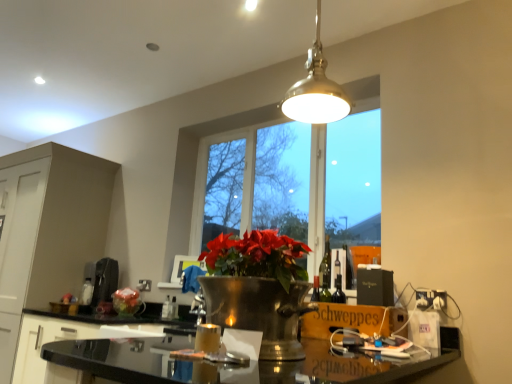
What do you see at coordinates (47, 231) in the screenshot? The image size is (512, 384). I see `matte white cabinet at left, positioned as the 2th cabinetry in right-to-left order` at bounding box center [47, 231].

What is the approximate width of wooden schweppes box at lower right?

It is 11.46 inches.

At what (x,y) coordinates should I click in order to perform the action: click on translucent glass bottle at center, positioned as the 2th bottle in right-to-left order. Please return your answer as a coordinate pair (x, y). The height and width of the screenshot is (384, 512). Looking at the image, I should click on 166,309.

This screenshot has height=384, width=512. Identify the location of matte white cabinet at left, marked as the first cabinetry in a left-to-right arrangement. (47, 231).

Does clear glass window at center have a greater width compared to matte white cabinet at left, positioned as the 2th cabinetry in right-to-left order?

No, clear glass window at center is not wider than matte white cabinet at left, positioned as the 2th cabinetry in right-to-left order.

There is a clear glass window at center. Where is `the 1st cabinetry below it (from a real-world perspective)`? the 1st cabinetry below it (from a real-world perspective) is located at coordinates (47, 231).

Is clear glass window at center looking in the opposite direction of matte white cabinet at left, marked as the first cabinetry in a left-to-right arrangement?

clear glass window at center does not have its back to matte white cabinet at left, marked as the first cabinetry in a left-to-right arrangement.

Is clear glass window at center situated inside matte white cabinet at left, positioned as the 2th cabinetry in right-to-left order, or outside?

A: clear glass window at center is not enclosed by matte white cabinet at left, positioned as the 2th cabinetry in right-to-left order.

What's the angular difference between white plastic electric outlet at lower right and metallic silver flower at center's facing directions?

The angle between the facing direction of white plastic electric outlet at lower right and the facing direction of metallic silver flower at center is 2.73 degrees.

Does point (433, 291) come farther from viewer compared to point (127, 287)?

No.

Does white plastic electric outlet at lower right have a larger size compared to metallic silver flower at center?

No, white plastic electric outlet at lower right is not bigger than metallic silver flower at center.

From a real-world perspective, is white plastic electric outlet at lower right on top of metallic silver flower at center?

Yes.

Does point (63, 214) come in front of point (172, 308)?

No.

Is matte white cabinet at left, positioned as the 2th cabinetry in right-to-left order, situated inside translucent glass bottle at center, which is counted as the first bottle, starting from the right, or outside?

matte white cabinet at left, positioned as the 2th cabinetry in right-to-left order, is located beyond the bounds of translucent glass bottle at center, which is counted as the first bottle, starting from the right.

Considering the positions of objects matte white cabinet at left, marked as the first cabinetry in a left-to-right arrangement, and translucent glass bottle at center, the second bottle in the left-to-right sequence, in the image provided, who is more to the left, matte white cabinet at left, marked as the first cabinetry in a left-to-right arrangement, or translucent glass bottle at center, the second bottle in the left-to-right sequence,?

From the viewer's perspective, matte white cabinet at left, marked as the first cabinetry in a left-to-right arrangement, appears more on the left side.

From the image's perspective, is matte white cabinet at left, positioned as the 2th cabinetry in right-to-left order, located above translucent glass bottle at center, the second bottle in the left-to-right sequence?

Yes, from the image's perspective, matte white cabinet at left, positioned as the 2th cabinetry in right-to-left order, is above translucent glass bottle at center, the second bottle in the left-to-right sequence.

Which object is closer to the camera, metallic silver flower at center or translucent glass bottle at center, the second bottle in the left-to-right sequence?

Positioned in front is translucent glass bottle at center, the second bottle in the left-to-right sequence.

From a real-world perspective, between metallic silver flower at center and translucent glass bottle at center, the second bottle in the left-to-right sequence, who is vertically lower?

translucent glass bottle at center, the second bottle in the left-to-right sequence.

Is metallic silver flower at center taller than translucent glass bottle at center, the second bottle in the left-to-right sequence?

Yes.

What's the angular difference between metallic silver flower at center and translucent glass bottle at center, which is counted as the first bottle, starting from the right,'s facing directions?

metallic silver flower at center and translucent glass bottle at center, which is counted as the first bottle, starting from the right, are facing 1.32 degrees away from each other.

Could you tell me if clear glass window at center is facing white plastic electric outlet at lower right?

No, clear glass window at center is not oriented towards white plastic electric outlet at lower right.

Is point (237, 179) farther from camera compared to point (423, 308)?

Yes, it is behind point (423, 308).

Based on the photo, from the image's perspective, which one is positioned higher, clear glass window at center or white plastic electric outlet at lower right?

clear glass window at center appears higher in the image.

Is clear glass window at center behind metallic silver flower at center?

No, it is in front of metallic silver flower at center.

Can you confirm if clear glass window at center is smaller than metallic silver flower at center?

Incorrect, clear glass window at center is not smaller in size than metallic silver flower at center.

Is clear glass window at center outside of metallic silver flower at center?

clear glass window at center is positioned outside metallic silver flower at center.

Measure the distance from wooden schweppes box at lower right to metallic silver flower at center.

A distance of 1.66 meters exists between wooden schweppes box at lower right and metallic silver flower at center.

In the scene shown: Based on their positions, is wooden schweppes box at lower right located to the left or right of metallic silver flower at center?

From the image, it's evident that wooden schweppes box at lower right is to the right of metallic silver flower at center.

In terms of size, does wooden schweppes box at lower right appear bigger or smaller than metallic silver flower at center?

wooden schweppes box at lower right is bigger than metallic silver flower at center.

Is wooden schweppes box at lower right inside or outside of metallic silver flower at center?

wooden schweppes box at lower right is located beyond the bounds of metallic silver flower at center.

You are a GUI agent. You are given a task and a screenshot of the screen. Output one action in this format:
    pyautogui.click(x=<x>, y=<y>)
    Task: Click on the window in front of the matte white cabinet at left, positioned as the 2th cabinetry in right-to-left order
    
    Given the screenshot: What is the action you would take?
    pyautogui.click(x=293, y=180)

At what (x,y) coordinates should I click in order to perform the action: click on electric outlet above the metallic silver flower at center (from the image's perspective). Please return your answer as a coordinate pair (x, y). Image resolution: width=512 pixels, height=384 pixels. Looking at the image, I should click on (431, 299).

Which object lies further to the anchor point white plastic electric outlet at lower right, metallic pendant light at upper center or translucent glass bottle at center, which ranks as the 1th bottle in left-to-right order?

translucent glass bottle at center, which ranks as the 1th bottle in left-to-right order.

Based on their spatial positions, is black matte coffee machine at left or clear glass window at center further from matte white cabinet at left, marked as the first cabinetry in a left-to-right arrangement?

Based on the image, clear glass window at center appears to be further to matte white cabinet at left, marked as the first cabinetry in a left-to-right arrangement.

Looking at the image, which one is located closer to wooden schweppes box at lower right, black glossy countertop at lower center, which ranks as the first cabinetry in right-to-left order, or matte white cabinet at left, marked as the first cabinetry in a left-to-right arrangement?

Based on the image, black glossy countertop at lower center, which ranks as the first cabinetry in right-to-left order, appears to be nearer to wooden schweppes box at lower right.

Which object lies further to the anchor point white plastic electric outlet at lower right, black glossy countertop at center or translucent glass bottle at center, which is counted as the first bottle, starting from the right?

black glossy countertop at center is further to white plastic electric outlet at lower right.

Which object lies further to the anchor point black glossy countertop at center, metallic pendant light at upper center or matte white cabinet at left, marked as the first cabinetry in a left-to-right arrangement?

metallic pendant light at upper center is further to black glossy countertop at center.

When comparing their distances from metallic pendant light at upper center, does black glossy countertop at center or matte white cabinet at left, positioned as the 2th cabinetry in right-to-left order, seem further?

matte white cabinet at left, positioned as the 2th cabinetry in right-to-left order.

Estimate the real-world distances between objects in this image. Which object is closer to black glossy countertop at center, matte white cabinet at left, positioned as the 2th cabinetry in right-to-left order, or metallic pendant light at upper center?

matte white cabinet at left, positioned as the 2th cabinetry in right-to-left order, is positioned closer to the anchor black glossy countertop at center.

When comparing their distances from black matte coffee machine at left, does matte white cabinet at left, marked as the first cabinetry in a left-to-right arrangement, or translucent glass bottle at center, positioned as the 2th bottle in right-to-left order, seem closer?

translucent glass bottle at center, positioned as the 2th bottle in right-to-left order, is positioned closer to the anchor black matte coffee machine at left.

At what (x,y) coordinates should I click in order to perform the action: click on window between translucent glass bottle at center, which ranks as the 1th bottle in left-to-right order, and white plastic electric outlet at lower right. Please return your answer as a coordinate pair (x, y). The image size is (512, 384). Looking at the image, I should click on (293, 180).

The image size is (512, 384). In order to click on cardboard box between black glossy countertop at center and clear glass window at center in the front-back direction in this screenshot , I will do 354,320.

Image resolution: width=512 pixels, height=384 pixels. I want to click on window between black matte coffee machine at left and wooden schweppes box at lower right in the horizontal direction, so click(293, 180).

Where is `electric outlet that lies between metallic pendant light at upper center and translucent glass bottle at center, which is counted as the first bottle, starting from the right, from top to bottom`? electric outlet that lies between metallic pendant light at upper center and translucent glass bottle at center, which is counted as the first bottle, starting from the right, from top to bottom is located at coordinates (431, 299).